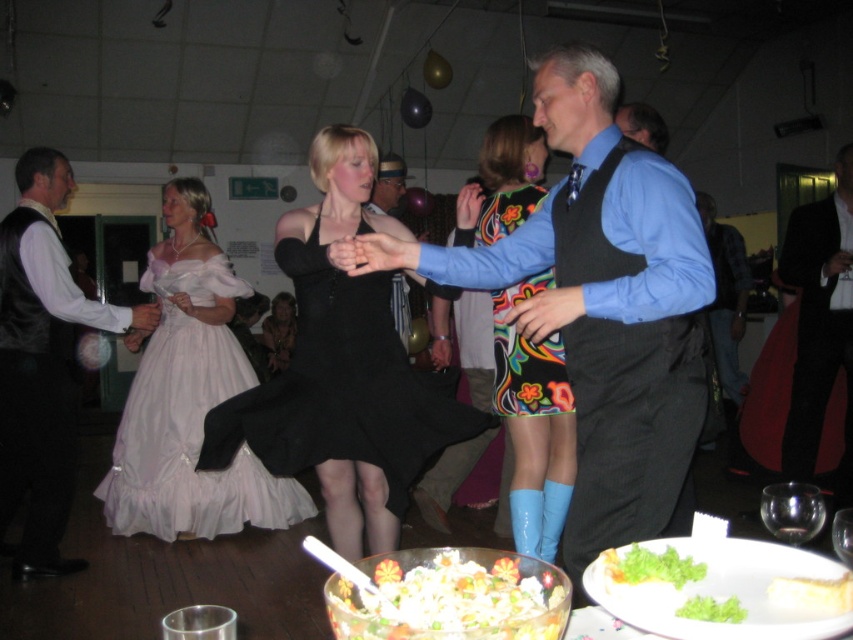
Question: Does green leafy garnish at lower right appear on the left side of velvet black dress at center?

Choices:
 (A) yes
 (B) no

Answer: (B)

Question: Does white creamy salad at lower center lie behind green leafy vegetable at lower center?

Choices:
 (A) yes
 (B) no

Answer: (B)

Question: Can you confirm if black satin dress at center is positioned above white creamy salad at lower center?

Choices:
 (A) no
 (B) yes

Answer: (B)

Question: Based on their relative distances, which object is farther from the white creamy cake at lower right?

Choices:
 (A) blue shirt at center
 (B) black smooth suit at center
 (C) floral print fabric dress at center
 (D) velvet black dress at center

Answer: (D)

Question: Which of these objects is positioned closest to the green leafy vegetable at lower center?

Choices:
 (A) blue textured vest at center
 (B) velvet black dress at center
 (C) green leafy salad at lower center

Answer: (C)

Question: Which object appears farthest from the camera in this image?

Choices:
 (A) white creamy salad at lower center
 (B) floral print fabric dress at center
 (C) black smooth suit at center

Answer: (C)